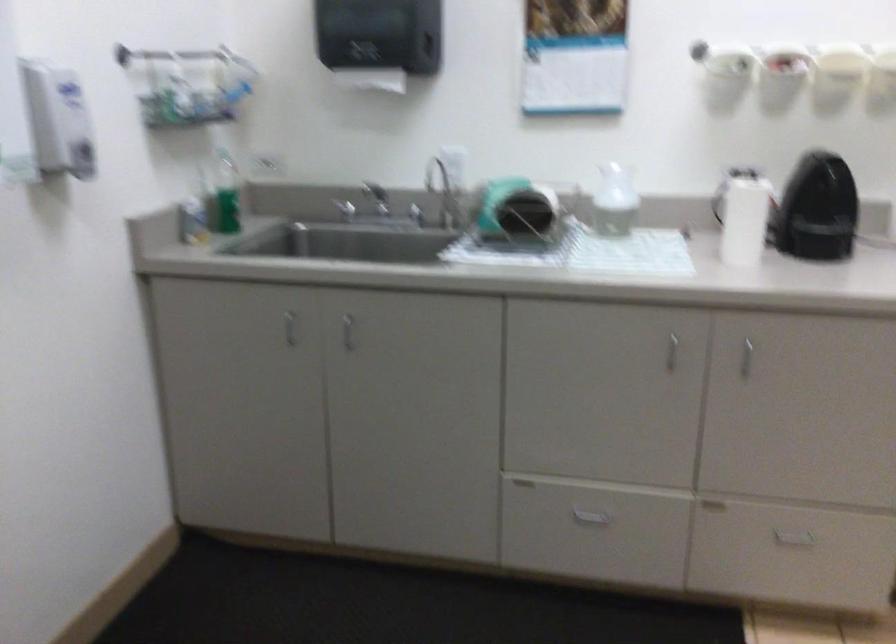
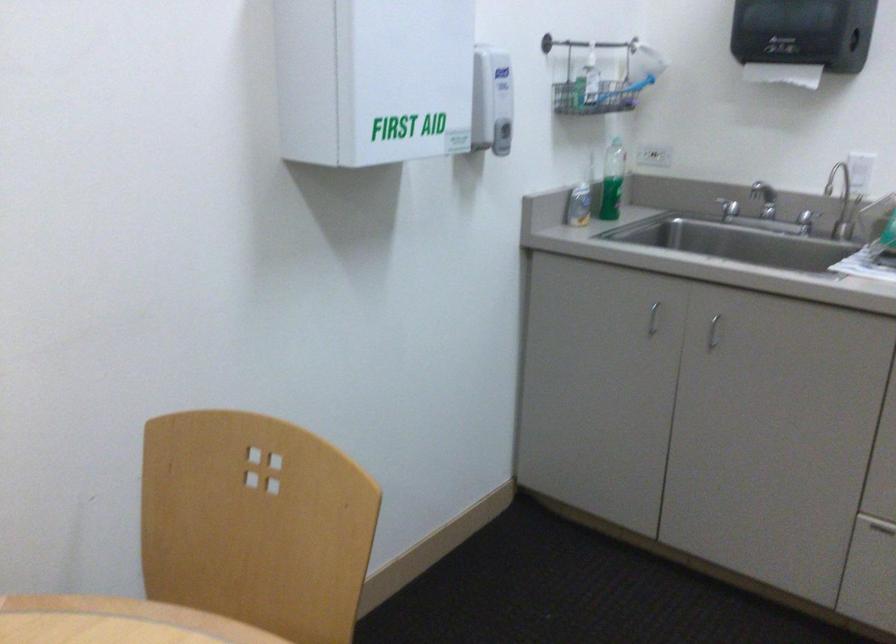
The point at (222, 196) is marked in the first image. Where is the corresponding point in the second image?

(613, 181)